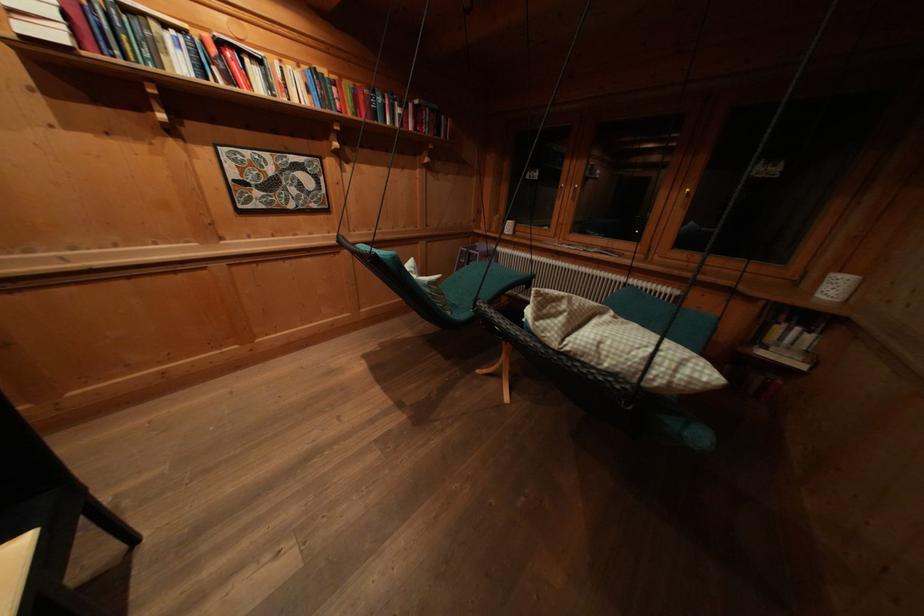
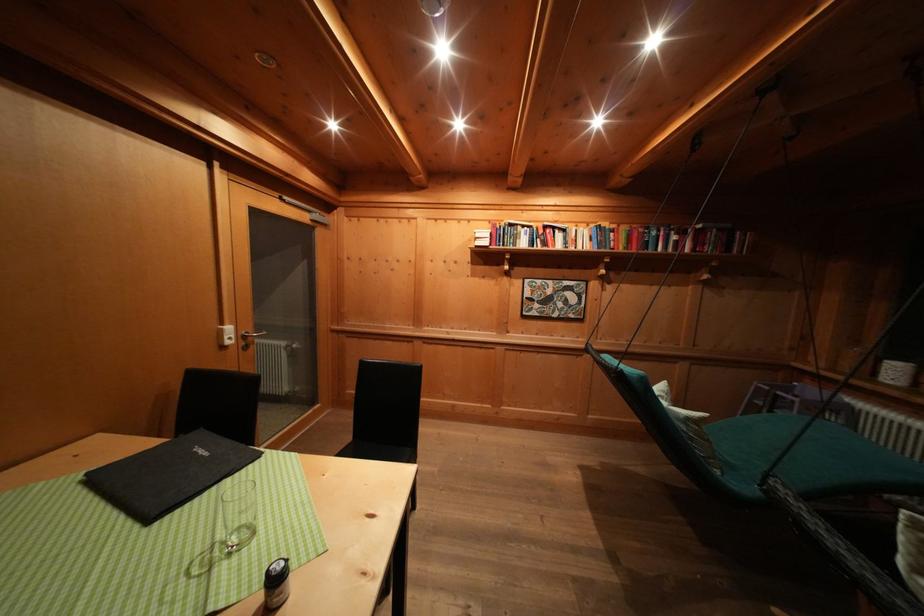
Question: The camera is either moving clockwise (left) or counter-clockwise (right) around the object. The first image is from the beginning of the video and the second image is from the end. Is the camera moving left or right when shooting the video?

Choices:
 (A) Left
 (B) Right

Answer: (B)